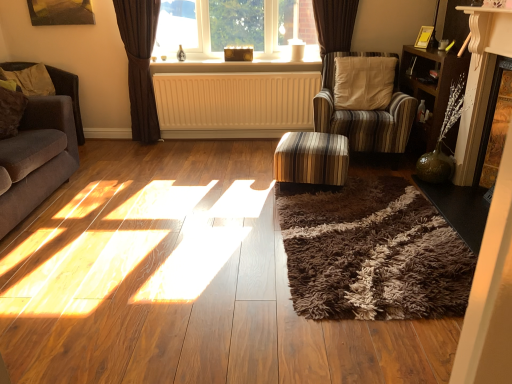
Question: Considering the positions of white plastic radiator at center and velvet brown couch at left in the image, is white plastic radiator at center wider or thinner than velvet brown couch at left?

Choices:
 (A) wide
 (B) thin

Answer: (B)

Question: Considering the positions of white plastic radiator at center and velvet brown couch at left in the image, is white plastic radiator at center bigger or smaller than velvet brown couch at left?

Choices:
 (A) big
 (B) small

Answer: (B)

Question: Which of these objects is positioned farthest from the white plastic radiator at center?

Choices:
 (A) brown fabric curtain at upper center
 (B) striped fabric chair at center-right
 (C) velvet brown couch at left
 (D) clear glass window at center
 (E) brown fabric armchair at left

Answer: (C)

Question: Based on their relative distances, which object is nearer to the white plastic radiator at center?

Choices:
 (A) wooden bookshelf at right
 (B) striped fabric chair at center-right
 (C) soft beige fabric pillow at left
 (D) brown fabric armchair at left
 (E) striped fabric ottoman at center

Answer: (B)